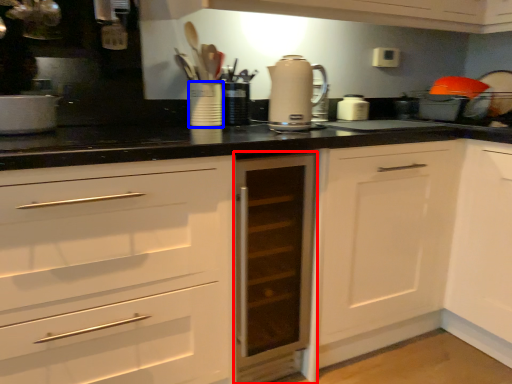
Question: Which object is closer to the camera taking this photo, cabinetry (highlighted by a red box) or appliance (highlighted by a blue box)?

Choices:
 (A) cabinetry
 (B) appliance

Answer: (A)